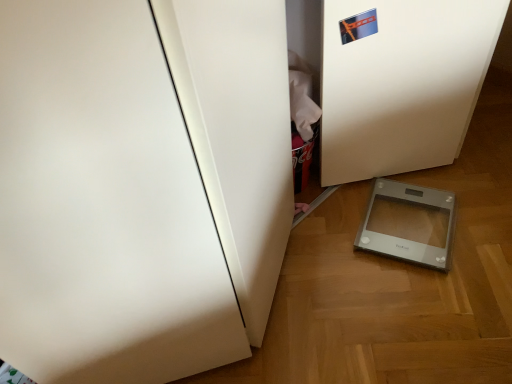
Find the location of a particular element. This screenshot has height=384, width=512. vacant area situated to the left side of transparent plastic scale at lower right is located at coordinates (331, 243).